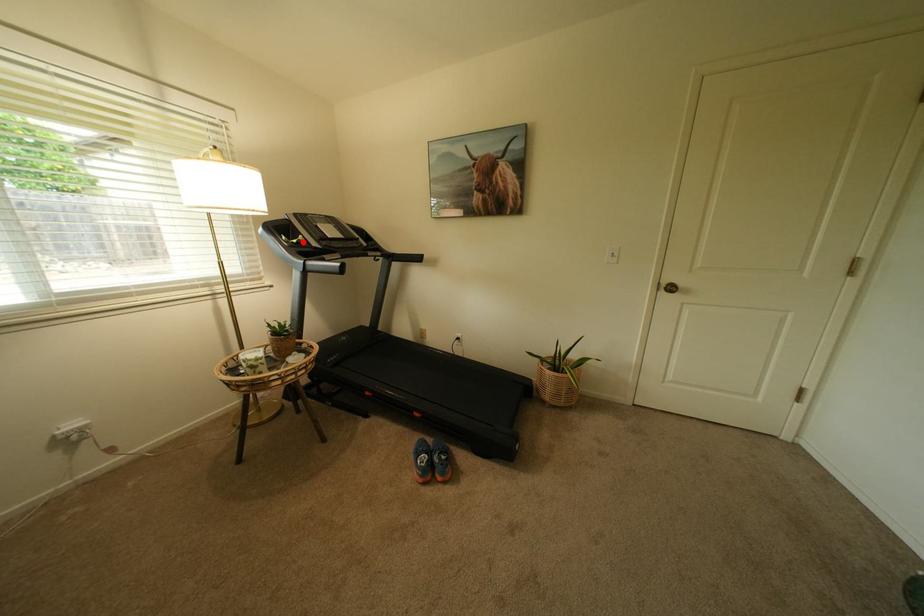
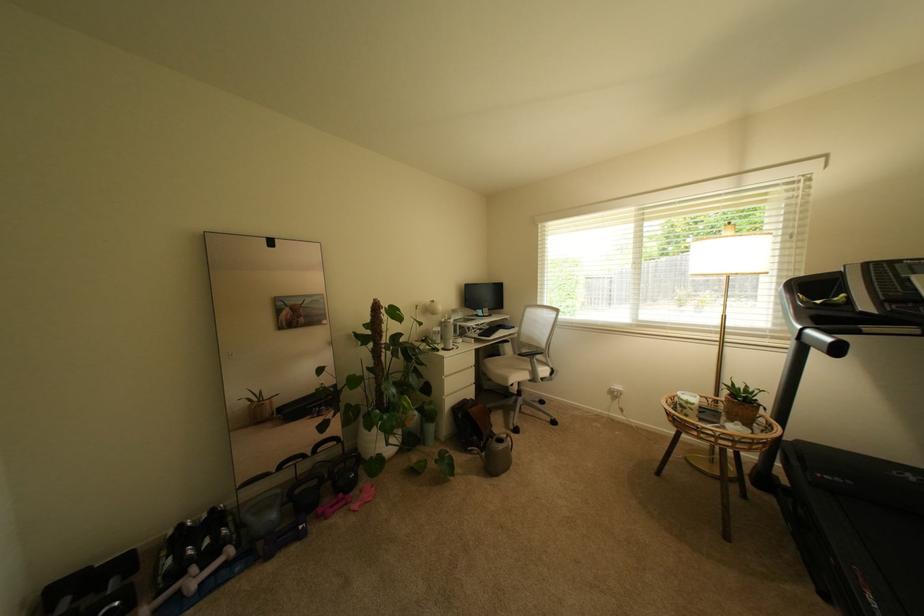
The point at the highlighted location is marked in the first image. Where is the corresponding point in the second image?

(827, 302)